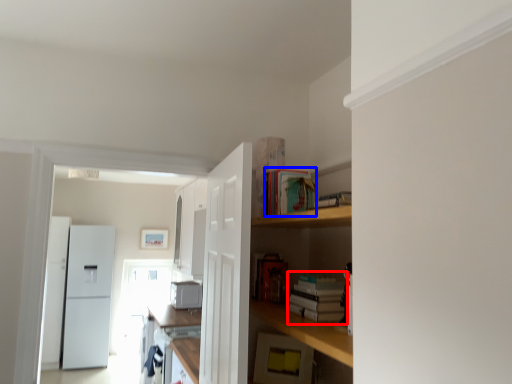
Question: Which of the following is the farthest to the observer, book (highlighted by a red box) or book (highlighted by a blue box)?

Choices:
 (A) book
 (B) book

Answer: (B)